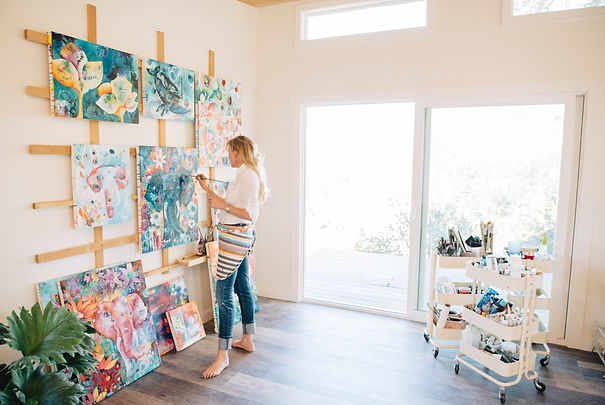
Locate an element on the screen. floor is located at coordinates (281, 375).